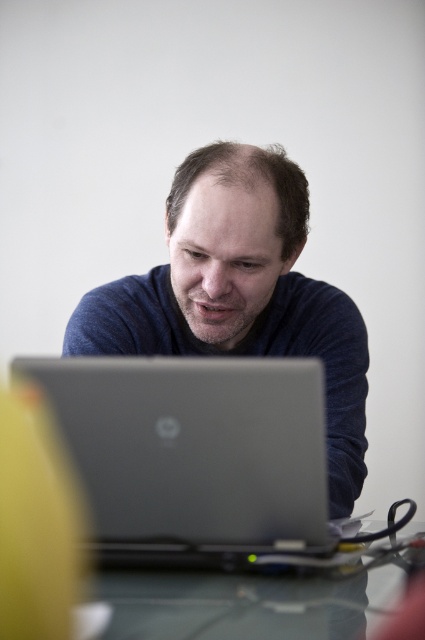
Does silver metallic laptop at center have a smaller size compared to clear glass table at center?

No, silver metallic laptop at center is not smaller than clear glass table at center.

Is silver metallic laptop at center to the left of clear glass table at center from the viewer's perspective?

Indeed, silver metallic laptop at center is positioned on the left side of clear glass table at center.

The image size is (425, 640). In order to click on silver metallic laptop at center in this screenshot , I will do `click(192, 454)`.

The image size is (425, 640). Identify the location of silver metallic laptop at center. (192, 454).

Does silver metallic laptop at center appear on the right side of matte blue sweater at center?

Incorrect, silver metallic laptop at center is not on the right side of matte blue sweater at center.

Is silver metallic laptop at center bigger than matte blue sweater at center?

Actually, silver metallic laptop at center might be smaller than matte blue sweater at center.

Who is more forward, (203,365) or (181,282)?

Point (203,365)

Image resolution: width=425 pixels, height=640 pixels. I want to click on silver metallic laptop at center, so click(192, 454).

Who is shorter, matte blue sweater at center or clear glass table at center?

Standing shorter between the two is clear glass table at center.

Is matte blue sweater at center smaller than clear glass table at center?

Incorrect, matte blue sweater at center is not smaller in size than clear glass table at center.

Does point (263, 216) come in front of point (399, 560)?

No, (263, 216) is behind (399, 560).

Locate an element on the screen. matte blue sweater at center is located at coordinates (240, 292).